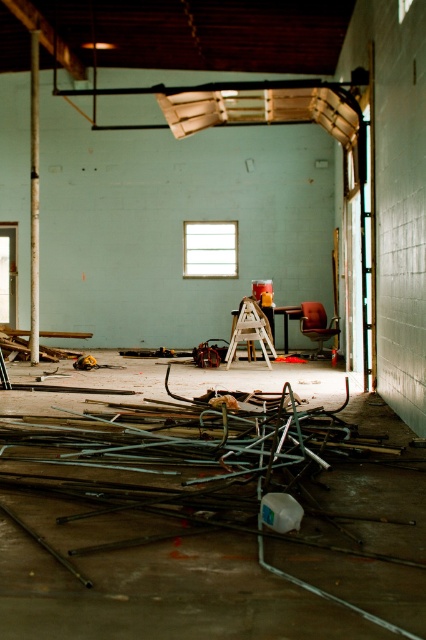
You are a maintenance worker in the warehouse. You need to move the leatherette office chair at center to the right side of the metallic gray metal at center. Is this possible? Explain why or why not based on their positions.

The metallic gray metal at center is to the left of the leatherette office chair at center. Moving the leatherette office chair at center to the right side of the metallic gray metal at center would require placing it further to the right since the metallic gray metal is already positioned to its left. This should be possible as long as there is enough space available on the right side of the metallic gray metal at center.